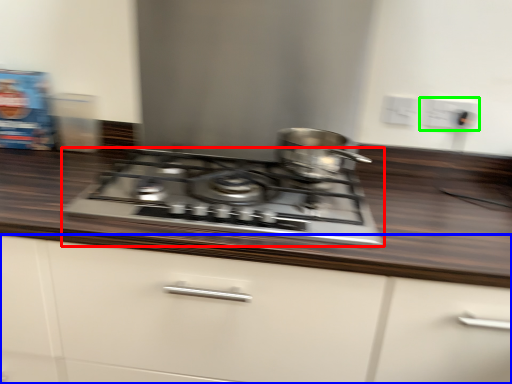
Question: Which object is positioned farthest from gas stove (highlighted by a red box)? Select from cabinetry (highlighted by a blue box) and electric outlet (highlighted by a green box).

Choices:
 (A) cabinetry
 (B) electric outlet

Answer: (B)